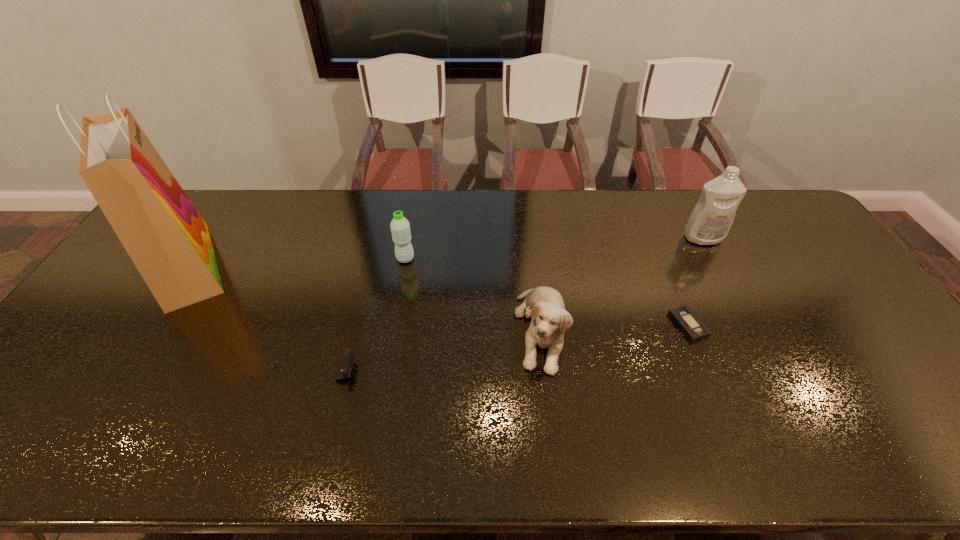
You are a GUI agent. You are given a task and a screenshot of the screen. Output one action in this format:
    pyautogui.click(x=<x>, y=<y>)
    Task: Click on the vacant space that's between the second tallest object and the third object from left to right
    
    Given the screenshot: What is the action you would take?
    pyautogui.click(x=554, y=248)

This screenshot has height=540, width=960. I want to click on unoccupied area between the fourth object from left to right and the videotape, so click(614, 327).

At what (x,y) coordinates should I click in order to perform the action: click on vacant area that lies between the second tallest object and the videotape. Please return your answer as a coordinate pair (x, y). Looking at the image, I should click on (696, 281).

Where is `vacant area that lies between the fourth tallest object and the shopping bag`? This screenshot has height=540, width=960. vacant area that lies between the fourth tallest object and the shopping bag is located at coordinates (365, 298).

Where is `free space between the water bottle and the fifth tallest object`? The image size is (960, 540). free space between the water bottle and the fifth tallest object is located at coordinates (358, 316).

The image size is (960, 540). Identify the location of object that can be found as the fourth closest to the webcam. (684, 317).

Identify which object is the second nearest to the fourth shortest object. Please provide its 2D coordinates. Your answer should be formatted as a tuple, i.e. [(x, y)], where the tuple contains the x and y coordinates of a point satisfying the conditions above.

[(344, 367)]

Where is `vacant area that satisfies the following two spatial constraints: 1. on the front-facing side of the puppy; 2. on the front-facing side of the webcam`? vacant area that satisfies the following two spatial constraints: 1. on the front-facing side of the puppy; 2. on the front-facing side of the webcam is located at coordinates (546, 374).

You are a GUI agent. You are given a task and a screenshot of the screen. Output one action in this format:
    pyautogui.click(x=<x>, y=<y>)
    Task: Click on the free point that satisfies the following two spatial constraints: 1. on the front side of the tallest object; 2. on the right side of the second object from right to left
    This screenshot has width=960, height=540.
    Given the screenshot: What is the action you would take?
    pyautogui.click(x=149, y=325)